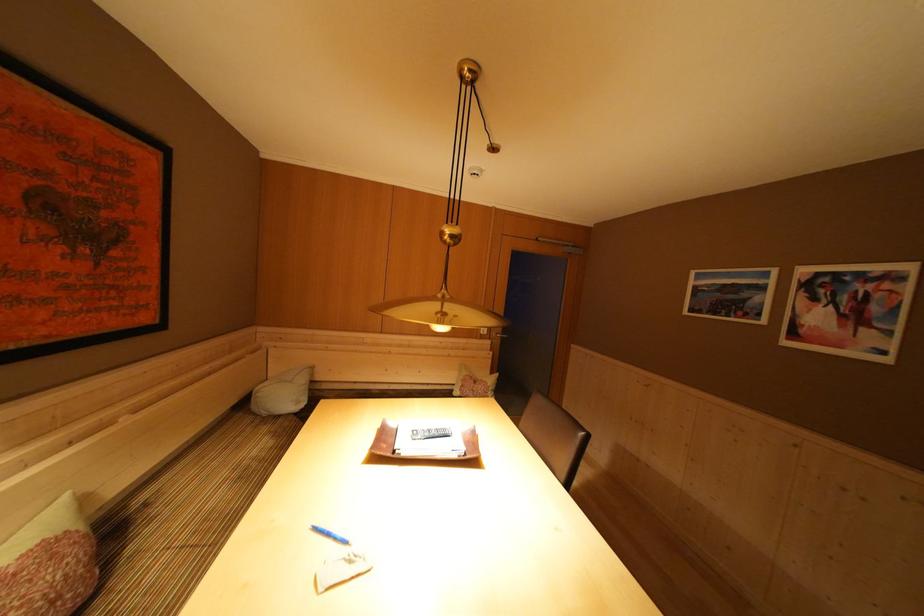
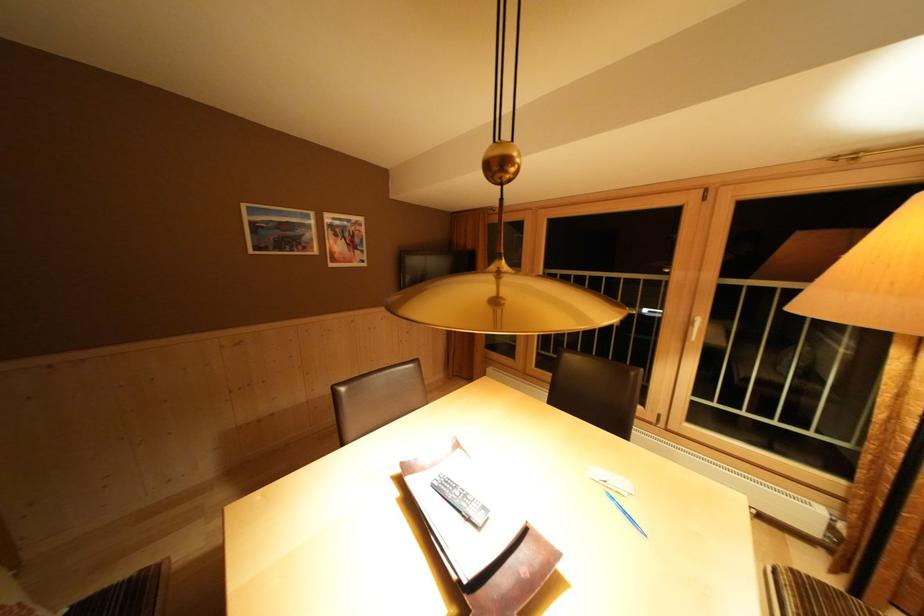
In the second image, find the point that corresponds to the point at 335,539 in the first image.

(633, 517)